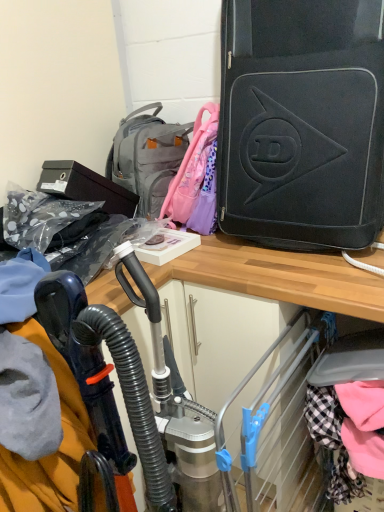
Question: Does point (142, 134) appear closer or farther from the camera than point (190, 398)?

Choices:
 (A) closer
 (B) farther

Answer: (B)

Question: Considering the positions of gray fabric backpack at upper center and metallic silver vacuum cleaner at center in the image, is gray fabric backpack at upper center wider or thinner than metallic silver vacuum cleaner at center?

Choices:
 (A) thin
 (B) wide

Answer: (A)

Question: Which object is positioned closest to the black matte suitcase at upper right?

Choices:
 (A) gray fabric backpack at upper center
 (B) metallic silver vacuum cleaner at center

Answer: (A)

Question: Considering the real-world distances, which object is farthest from the metallic silver vacuum cleaner at center?

Choices:
 (A) black matte suitcase at upper right
 (B) gray fabric backpack at upper center

Answer: (B)